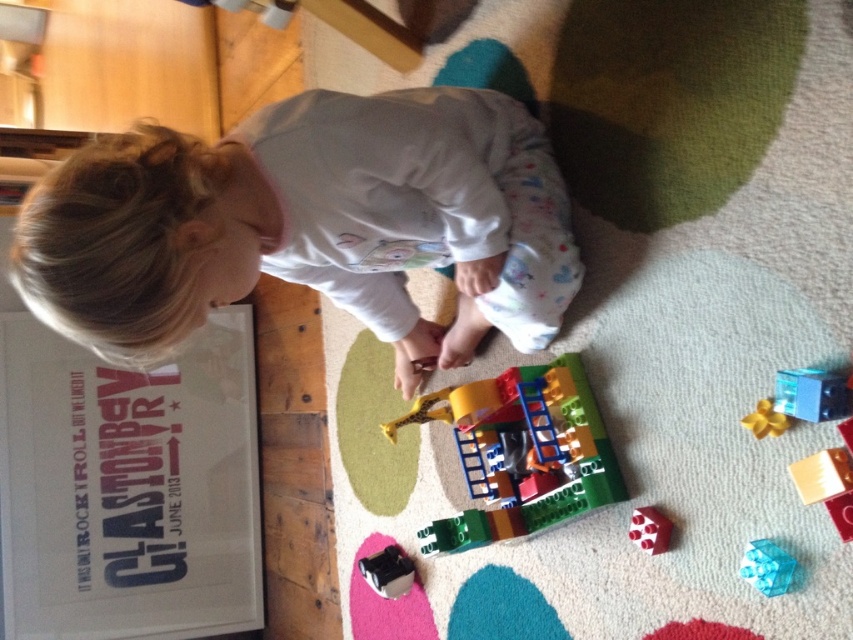
Between translucent plastic block at lower right and black plastic toy at lower center, which one is positioned lower?

black plastic toy at lower center is lower down.

Between point (850, 481) and point (392, 561), which one is positioned behind?

Positioned behind is point (392, 561).

Is point (851, 468) closer to camera compared to point (390, 579)?

Yes, point (851, 468) is in front of point (390, 579).

Where is `translucent plastic block at lower right`? translucent plastic block at lower right is located at coordinates pos(821,474).

Which is behind, point (596, 417) or point (646, 525)?

Point (596, 417)

Does translucent plastic building at center appear under rubber brick at center?

Incorrect, translucent plastic building at center is not positioned below rubber brick at center.

Is point (463, 396) positioned before point (656, 509)?

No, (463, 396) is behind (656, 509).

This screenshot has width=853, height=640. I want to click on translucent plastic building at center, so click(x=520, y=452).

Describe the element at coordinates (648, 529) in the screenshot. I see `rubber brick at center` at that location.

Between rubber brick at center and translucent yellow star at lower right, which one appears on the left side from the viewer's perspective?

From the viewer's perspective, rubber brick at center appears more on the left side.

The width and height of the screenshot is (853, 640). What are the coordinates of `rubber brick at center` in the screenshot? It's located at (648, 529).